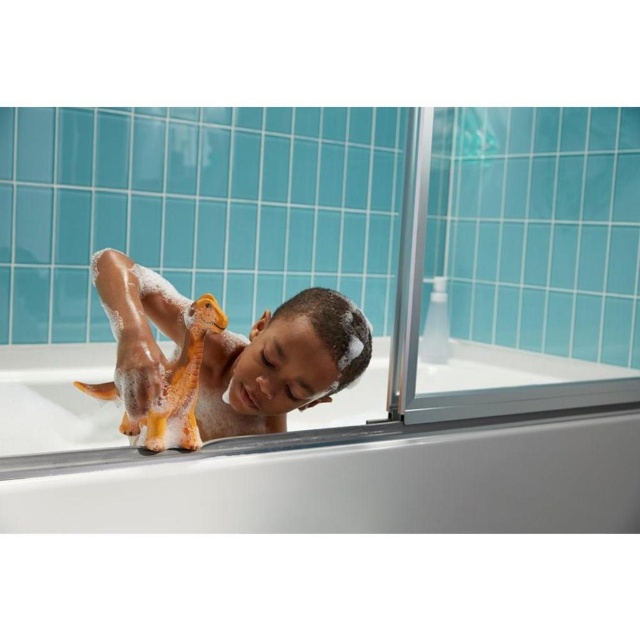
Question: Can you confirm if white glossy bathtub at center is positioned below orange rubber duck at center?

Choices:
 (A) yes
 (B) no

Answer: (A)

Question: Among these points, which one is farthest from the camera?

Choices:
 (A) (173, 378)
 (B) (307, 493)

Answer: (B)

Question: Among these points, which one is farthest from the camera?

Choices:
 (A) (122, 460)
 (B) (259, 356)

Answer: (B)

Question: Is white glossy bathtub at center to the left of orange rubber duck at center from the viewer's perspective?

Choices:
 (A) yes
 (B) no

Answer: (B)

Question: Is white glossy bathtub at center below orange rubber duck at center?

Choices:
 (A) no
 (B) yes

Answer: (B)